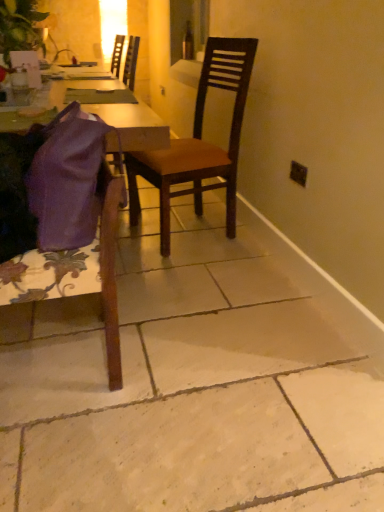
Find the location of `vacant space that's between purple fabric bag at lower left, the 1th chair from the front, and brown wooden chair at center, arranged as the second chair when viewed from the front`. vacant space that's between purple fabric bag at lower left, the 1th chair from the front, and brown wooden chair at center, arranged as the second chair when viewed from the front is located at coordinates (150, 286).